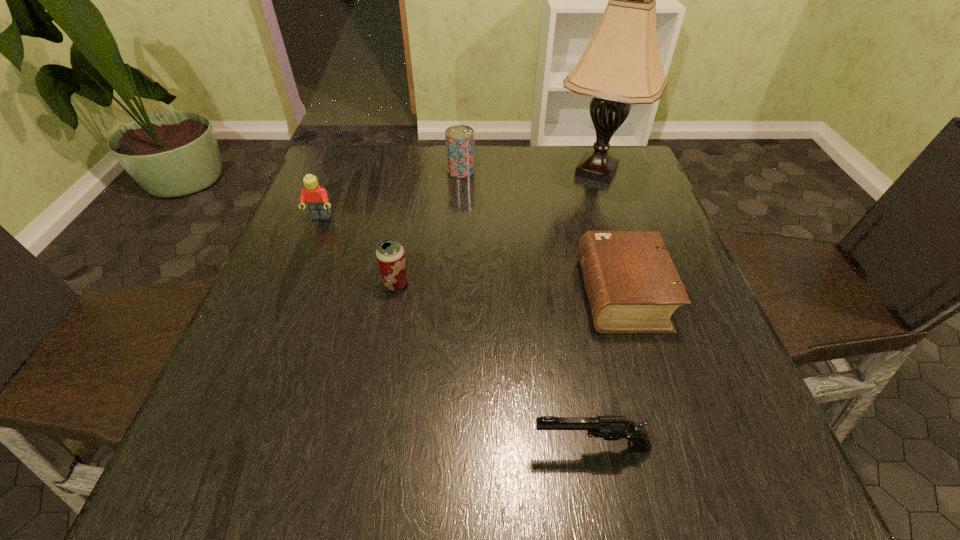
I want to click on free space that is in between the Lego and the farther beer can, so click(x=391, y=194).

You are a GUI agent. You are given a task and a screenshot of the screen. Output one action in this format:
    pyautogui.click(x=<x>, y=<y>)
    Task: Click on the object that stands as the fifth closest to the fifth object from right to left
    The height and width of the screenshot is (540, 960).
    Given the screenshot: What is the action you would take?
    pyautogui.click(x=621, y=65)

You are a GUI agent. You are given a task and a screenshot of the screen. Output one action in this format:
    pyautogui.click(x=<x>, y=<y>)
    Task: Click on the fourth closest object to the left beer can
    The height and width of the screenshot is (540, 960).
    Given the screenshot: What is the action you would take?
    pyautogui.click(x=612, y=427)

The width and height of the screenshot is (960, 540). Identify the location of vacant region that satisfies the following two spatial constraints: 1. on the back side of the farther beer can; 2. on the left side of the left beer can. (417, 171).

Locate an element on the screen. The width and height of the screenshot is (960, 540). vacant point that satisfies the following two spatial constraints: 1. on the face of the left beer can; 2. on the left side of the Lego is located at coordinates (295, 284).

Where is `vacant region that satisfies the following two spatial constraints: 1. on the front side of the tallest object; 2. on the right side of the right beer can`? This screenshot has height=540, width=960. vacant region that satisfies the following two spatial constraints: 1. on the front side of the tallest object; 2. on the right side of the right beer can is located at coordinates (461, 171).